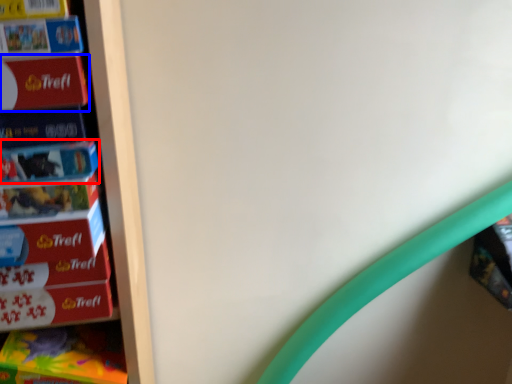
Question: Which point is further to the camera, paperback book (highlighted by a red box) or paperback book (highlighted by a blue box)?

Choices:
 (A) paperback book
 (B) paperback book

Answer: (A)